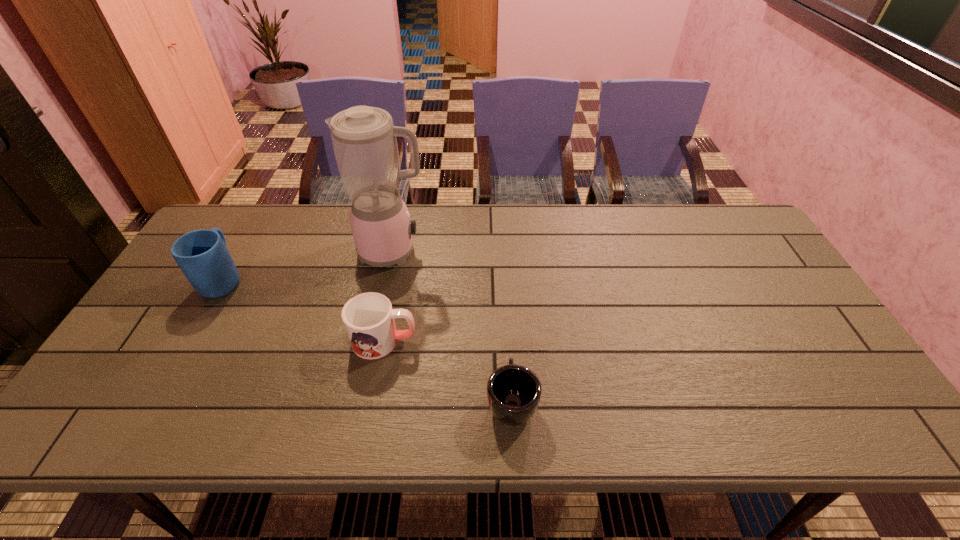
Identify the location of the tallest object. (364, 141).

The width and height of the screenshot is (960, 540). I want to click on the leftmost mug, so click(202, 255).

The width and height of the screenshot is (960, 540). Identify the location of the third shortest object. (202, 255).

Locate an element on the screen. The width and height of the screenshot is (960, 540). the third farthest object is located at coordinates point(369,320).

In order to click on the second shortest mug in this screenshot , I will do click(x=369, y=320).

I want to click on the shortest mug, so click(514, 391).

The width and height of the screenshot is (960, 540). Identify the location of the nearest object. (514, 391).

The image size is (960, 540). Find the location of `vacant space positioned on the base of the food processor near the control knob`. vacant space positioned on the base of the food processor near the control knob is located at coordinates (507, 252).

Where is `free spot located 0.200m on the side of the tallest mug with the handle`? Image resolution: width=960 pixels, height=540 pixels. free spot located 0.200m on the side of the tallest mug with the handle is located at coordinates (258, 219).

The width and height of the screenshot is (960, 540). I want to click on free spot located 0.210m on the side of the tallest mug with the handle, so 259,217.